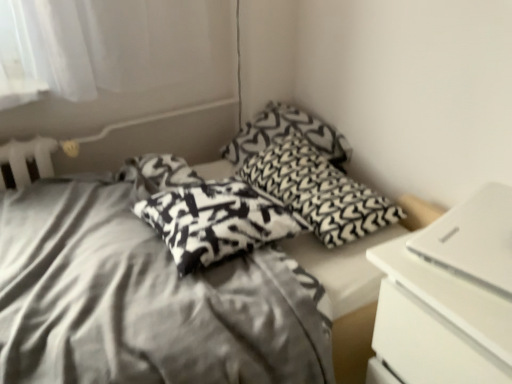
Find the location of a particular element. vacant area that is in front of black-and-white printed pillow at center, acting as the 1th pillow starting from the front is located at coordinates (184, 302).